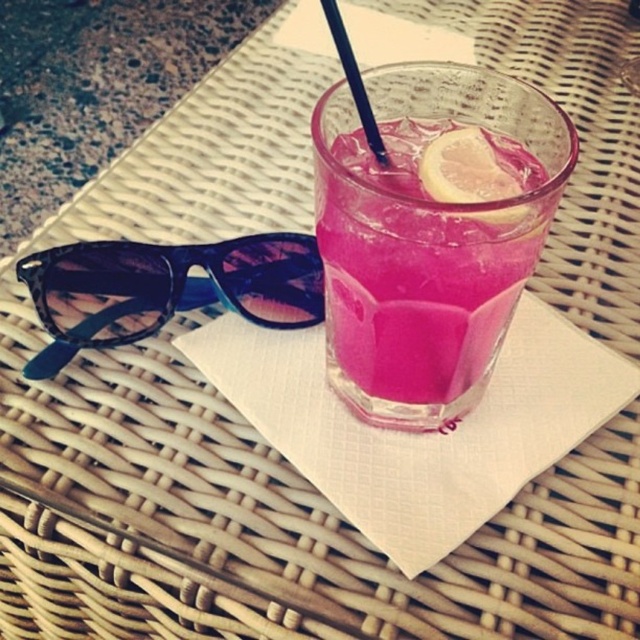
Between point (292, 273) and point (337, 51), which one is positioned in front?

Positioned in front is point (292, 273).

What do you see at coordinates (164, 289) in the screenshot? I see `leopard print acetate sunglasses at left` at bounding box center [164, 289].

Describe the element at coordinates (164, 289) in the screenshot. I see `leopard print acetate sunglasses at left` at that location.

The image size is (640, 640). I want to click on leopard print acetate sunglasses at left, so click(164, 289).

Is translucent yellow lemon at center to the right of transparent plastic straw at upper center from the viewer's perspective?

Indeed, translucent yellow lemon at center is positioned on the right side of transparent plastic straw at upper center.

Which is in front, point (468, 138) or point (349, 74)?

Positioned in front is point (349, 74).

Which is in front, point (451, 177) or point (376, 136)?

Positioned in front is point (451, 177).

At what (x,y) coordinates should I click in order to perform the action: click on translucent yellow lemon at center. Please return your answer as a coordinate pair (x, y). Image resolution: width=640 pixels, height=640 pixels. Looking at the image, I should click on (464, 170).

Find the location of a particular element. The image size is (640, 640). pink glass at center is located at coordinates (429, 230).

Which is in front, point (416, 330) or point (499, 188)?

Point (499, 188)

Is point (525, 176) positioned in front of point (448, 186)?

No, it is behind (448, 186).

Identify the location of pink glass at center. Image resolution: width=640 pixels, height=640 pixels. (429, 230).